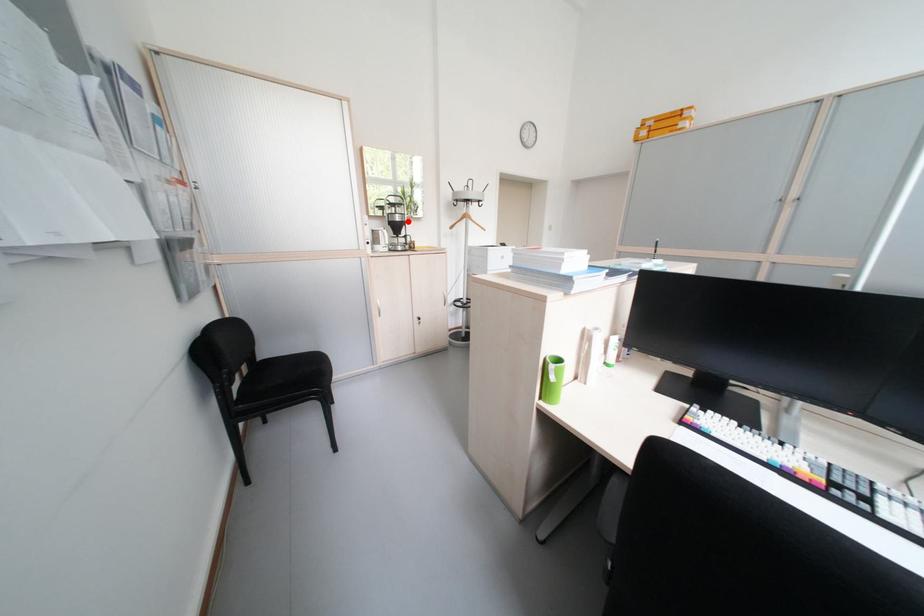
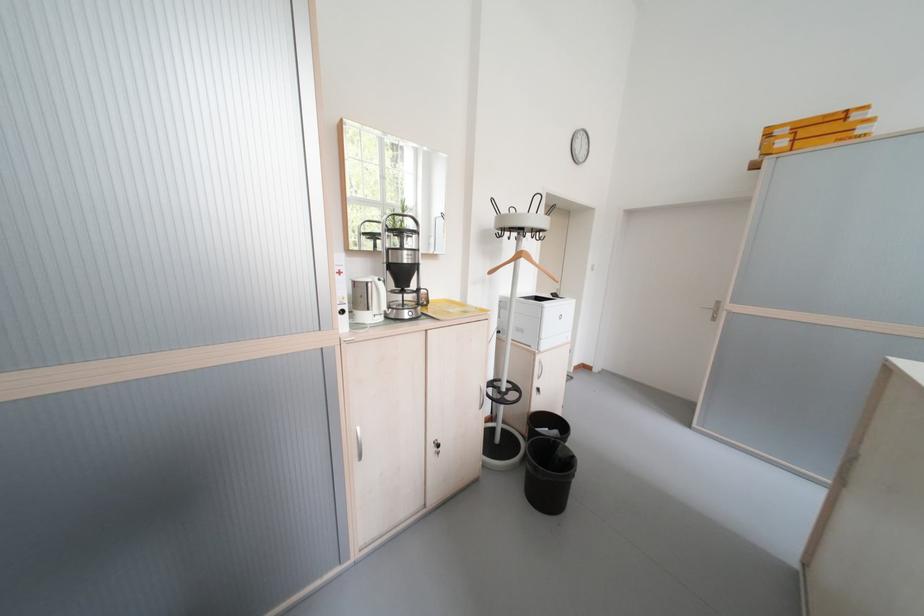
Question: I am providing you with two images of the same scene from different viewpoints. A red point is shown in image1. For the corresponding object point in image2, is it positioned nearer or farther from the camera?

Choices:
 (A) Nearer
 (B) Farther

Answer: (B)